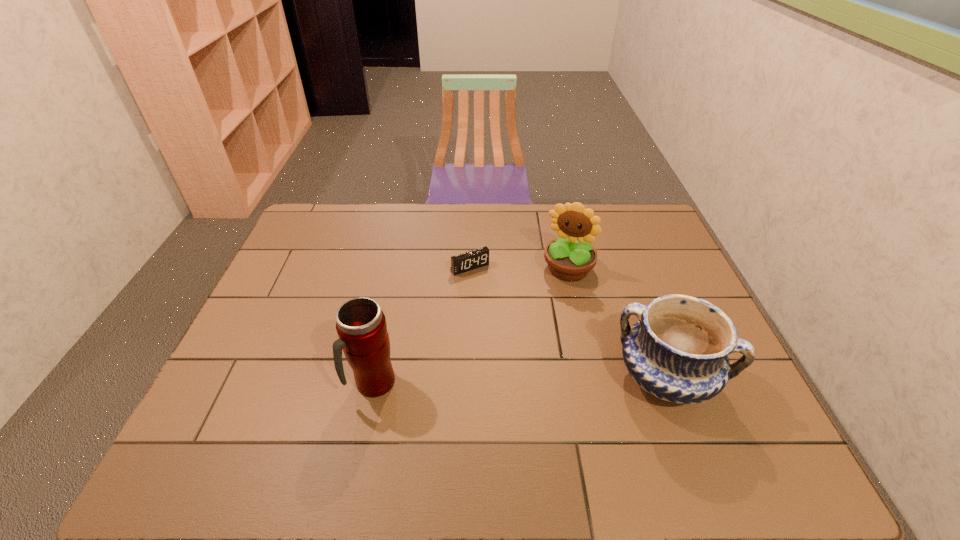
Where is `vacant space at the right edge`? vacant space at the right edge is located at coordinates (651, 276).

Find the location of a particular element. vacant region at the near left corner is located at coordinates (223, 412).

This screenshot has height=540, width=960. What are the coordinates of `vacant space at the far right corner of the desktop` in the screenshot? It's located at (644, 227).

The height and width of the screenshot is (540, 960). What are the coordinates of `unoccupied position between the third tallest object and the leftmost object` in the screenshot? It's located at (519, 381).

Where is `vacant area that lies between the thermos bottle and the second object from left to right`? vacant area that lies between the thermos bottle and the second object from left to right is located at coordinates point(421,326).

Image resolution: width=960 pixels, height=540 pixels. Find the location of `vacant area between the shortest object and the thermos bottle`. vacant area between the shortest object and the thermos bottle is located at coordinates (421, 326).

Where is `empty space between the thermos bottle and the third object from right to left`? empty space between the thermos bottle and the third object from right to left is located at coordinates (421, 326).

Identify the location of free area in between the pottery and the sunflower. The width and height of the screenshot is (960, 540). (617, 323).

Identify the location of empty location between the pottery and the alarm clock. The height and width of the screenshot is (540, 960). coord(567,323).

Where is `free space between the pottery and the thermos bottle`? free space between the pottery and the thermos bottle is located at coordinates (519, 381).